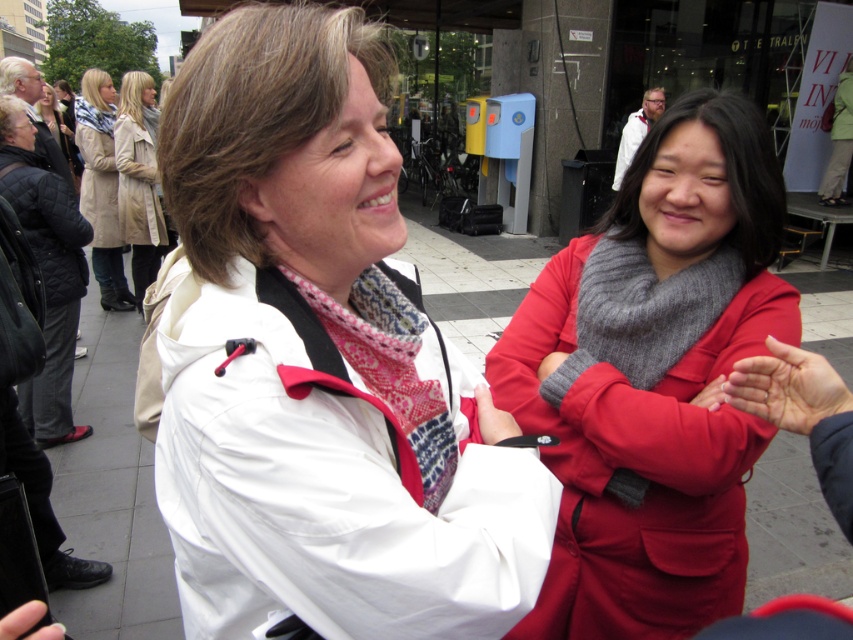
You are a photographer trying to capture a closeup of the matte red glove at center without the beige coat at upper left blocking the view. Is this possible given their positions?

The matte red glove at center is behind the beige coat at upper left, so it is blocked by the coat and cannot be seen without moving the coat.

You are a photographer trying to capture both the beige leather coat at upper left and the gray woolen scarf at upper right in a single frame. Based on their positions, which object should you adjust your camera to focus on first to ensure both are in the shot?

Since the beige leather coat at upper left is to the left of the gray woolen scarf at upper right, you should focus on the gray woolen scarf at upper right first to ensure both are within the frame.